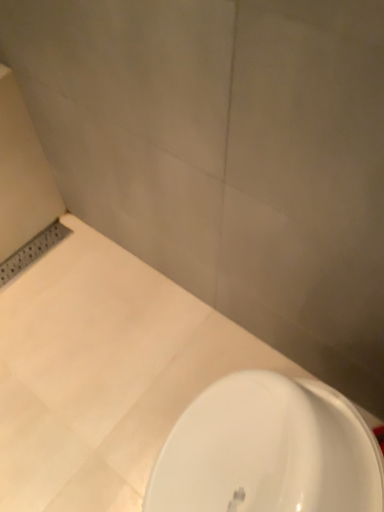
Describe the element at coordinates (103, 373) in the screenshot. This screenshot has width=384, height=512. I see `white glossy sink at lower center` at that location.

At what (x,y) coordinates should I click in order to perform the action: click on white glossy sink at lower center. Please return your answer as a coordinate pair (x, y). The height and width of the screenshot is (512, 384). Looking at the image, I should click on (103, 373).

Find the location of a particular element. The height and width of the screenshot is (512, 384). white glossy sink at lower center is located at coordinates (103, 373).